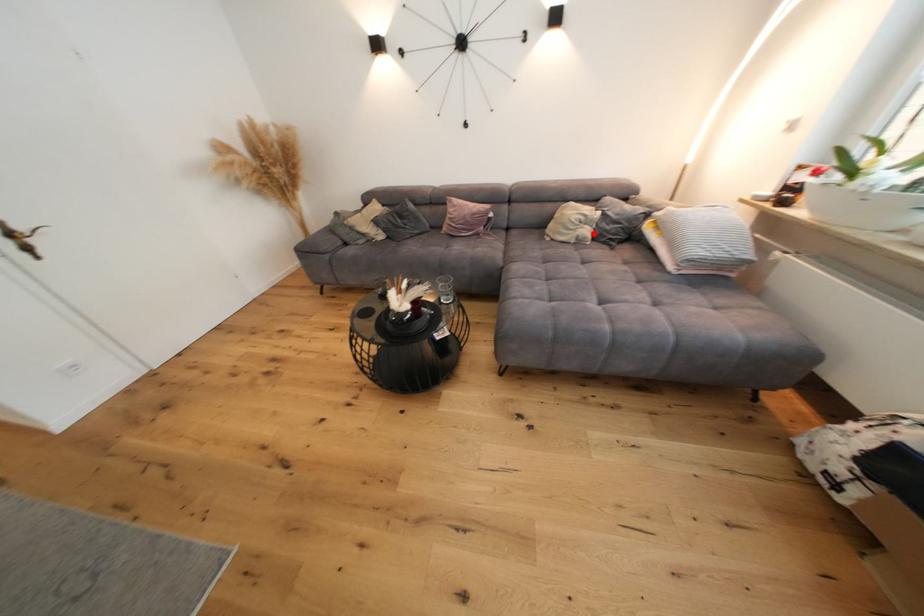
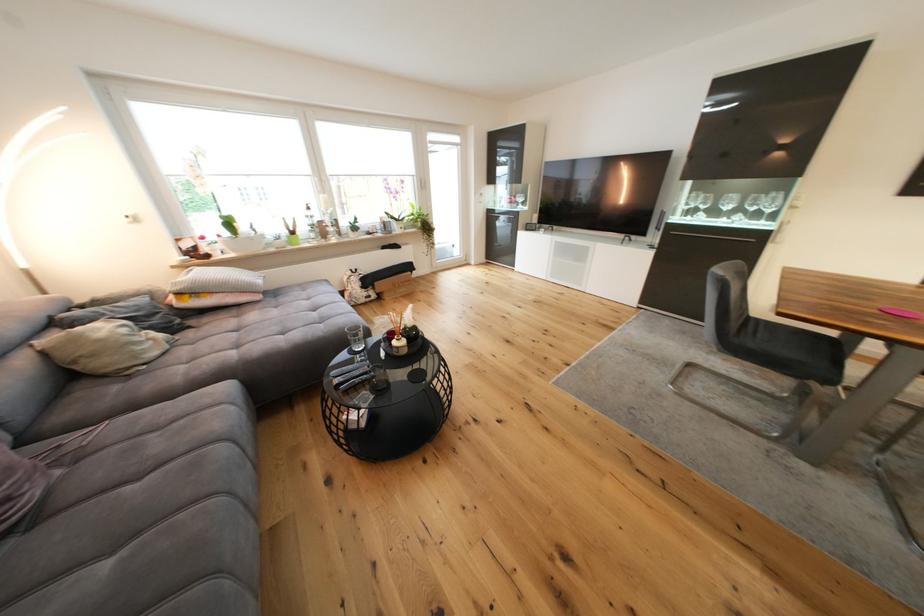
Question: I am providing you with two images of the same scene from different viewpoints. A red point is shown in image1. For the corresponding object point in image2, is it positioned nearer or farther from the camera?

Choices:
 (A) Nearer
 (B) Farther

Answer: (B)